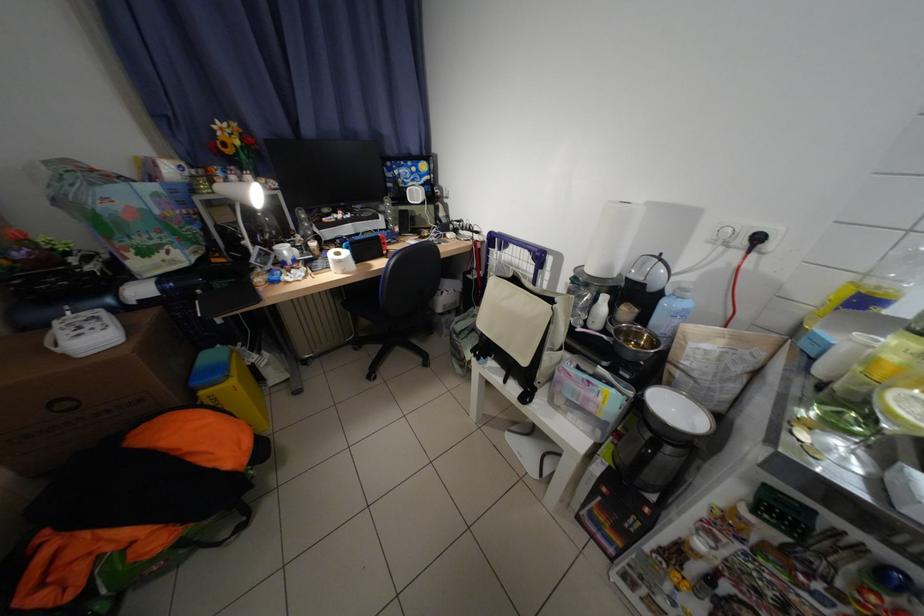
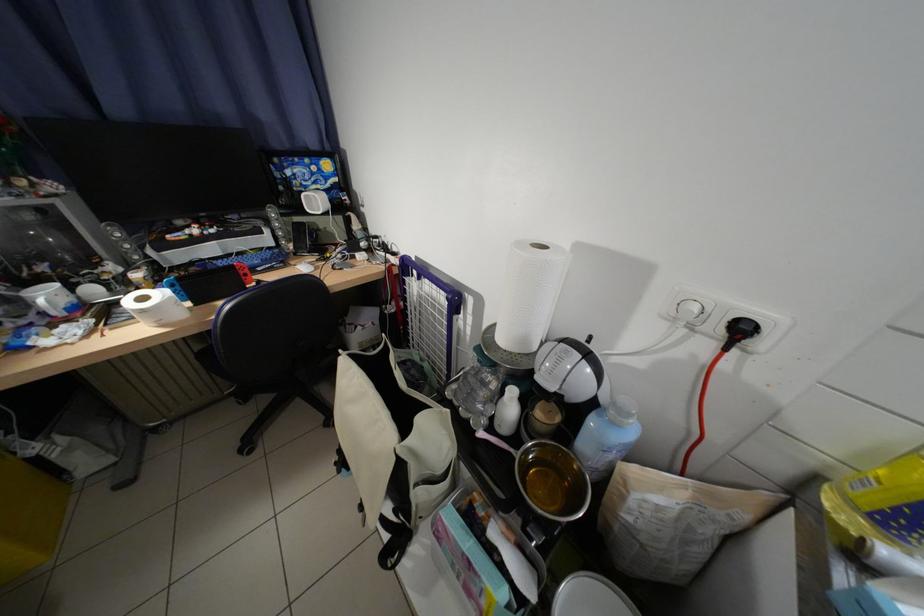
Question: How did the camera likely rotate?

Choices:
 (A) Left
 (B) Right
 (C) Up
 (D) Down

Answer: (B)